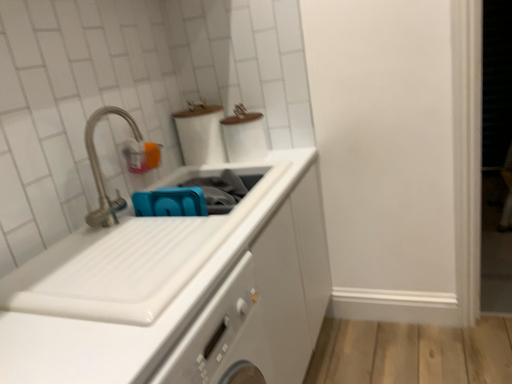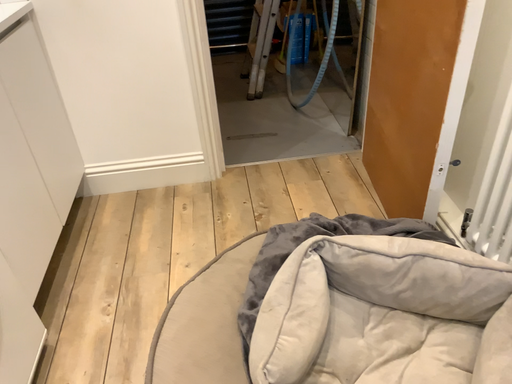
Question: Which way did the camera rotate in the video?

Choices:
 (A) rotated left
 (B) rotated right

Answer: (B)